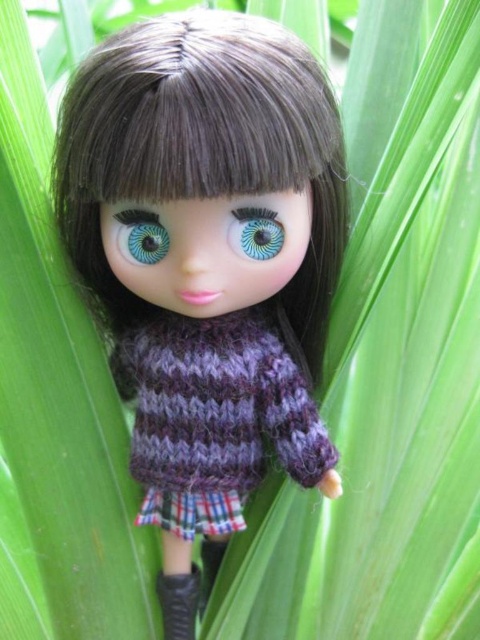
Question: Is black leather boot at lower center to the left of blue iridescent eye at center from the viewer's perspective?

Choices:
 (A) yes
 (B) no

Answer: (A)

Question: Among these points, which one is nearest to the camera?

Choices:
 (A) (84, 97)
 (B) (177, 605)
 (C) (259, 259)

Answer: (A)

Question: Is knitted purple sweater at center wider than blue iridescent eye at center?

Choices:
 (A) yes
 (B) no

Answer: (A)

Question: Which point is farther to the camera?

Choices:
 (A) (128, 256)
 (B) (199, 589)
 (C) (144, 28)
 (D) (273, 224)

Answer: (B)

Question: Which object is closer to the camera taking this photo?

Choices:
 (A) black leather boot at lower center
 (B) knitted purple sweater at center

Answer: (B)

Question: Does black leather boot at lower center have a lesser width compared to blue glossy eye at center?

Choices:
 (A) yes
 (B) no

Answer: (B)